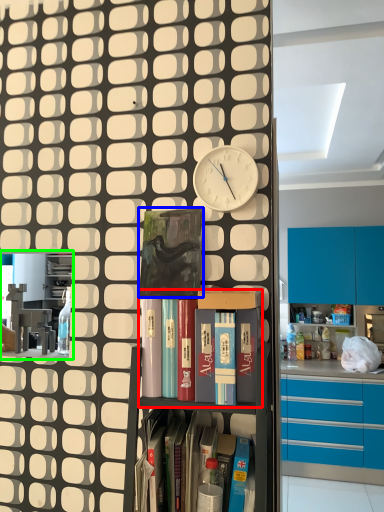
Question: Estimate the real-world distances between objects in this image. Which object is closer to shelf (highlighted by a red box), paperback book (highlighted by a blue box) or shelf (highlighted by a green box)?

Choices:
 (A) paperback book
 (B) shelf

Answer: (A)